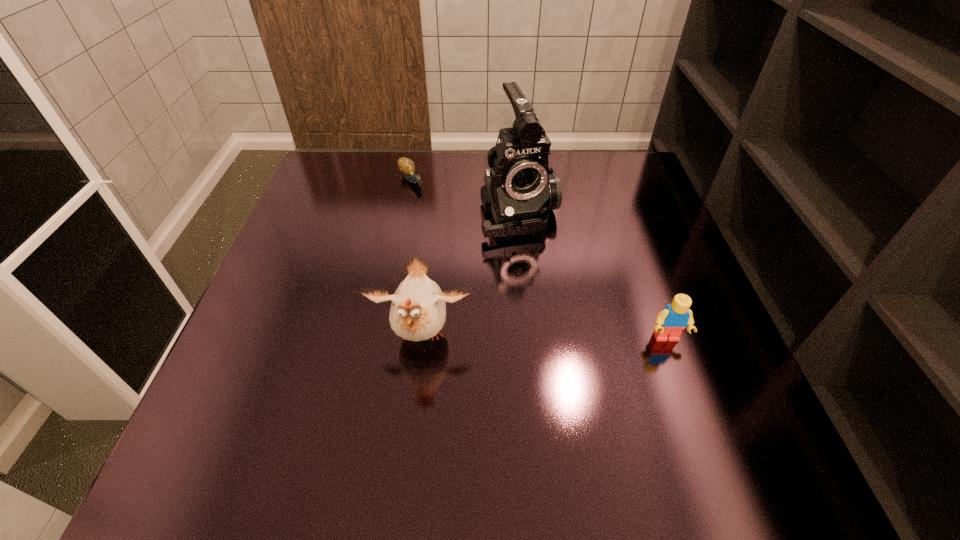
The height and width of the screenshot is (540, 960). Identify the location of vacant space located 0.380m on the front-facing side of the shortest object. (494, 276).

Image resolution: width=960 pixels, height=540 pixels. I want to click on free space located on the lens mount of the tallest object, so [596, 398].

In order to click on blank space located on the lens mount of the tallest object in this screenshot , I will do `click(551, 292)`.

This screenshot has width=960, height=540. I want to click on free space located on the lens mount of the tallest object, so click(543, 275).

What are the coordinates of `escargot that is at the far edge` in the screenshot? It's located at (407, 166).

At what (x,y) coordinates should I click in order to perform the action: click on camcorder that is at the far edge. Please return your answer as a coordinate pair (x, y). Looking at the image, I should click on (520, 190).

Find the location of a particular element. object at the right edge is located at coordinates (675, 317).

In the image, there is a desktop. Identify the location of free space at the far edge. This screenshot has height=540, width=960. (469, 157).

Where is `blank space at the left edge of the desktop`? This screenshot has height=540, width=960. blank space at the left edge of the desktop is located at coordinates (310, 335).

Find the location of a particular element. This screenshot has width=960, height=540. free location at the right edge is located at coordinates (677, 272).